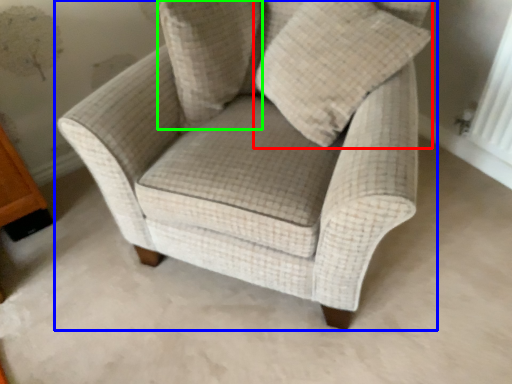
Question: Which object is the farthest from throw pillow (highlighted by a red box)? Choose among these: chair (highlighted by a blue box) or pillow (highlighted by a green box).

Choices:
 (A) chair
 (B) pillow

Answer: (B)